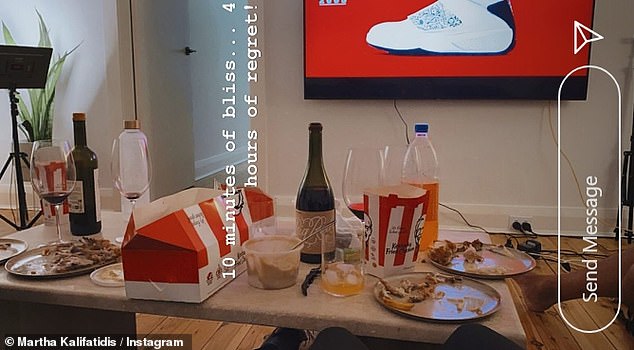
At what (x,y) coordinates should I click in order to perform the action: click on television set on the wall. Please return your answer as a coordinate pair (x, y). Image resolution: width=634 pixels, height=350 pixels. Looking at the image, I should click on (350, 59).